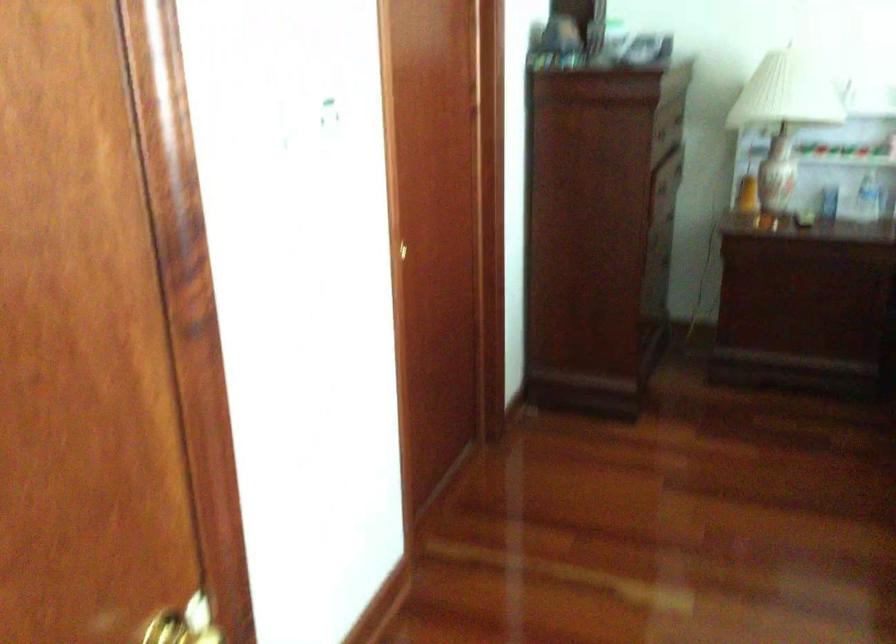
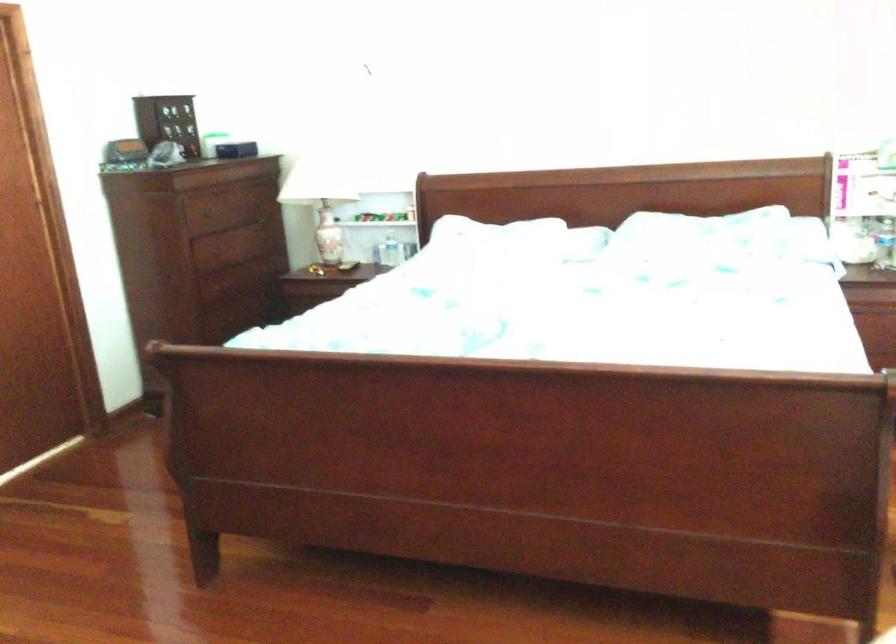
Which direction would the cameraman need to move to produce the second image?

The cameraman moved toward right, backward.